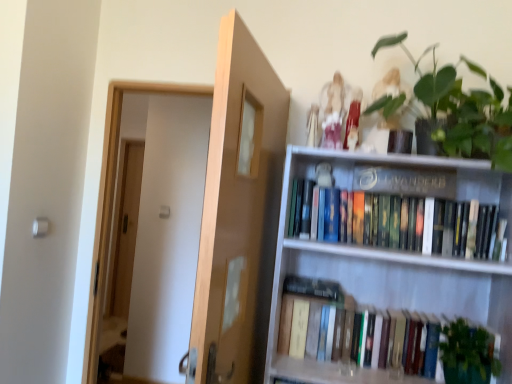
Find the location of `green matte plant at upper right`. green matte plant at upper right is located at coordinates (463, 110).

Locate an element on the screen. The image size is (512, 384). matte white statue at upper center is located at coordinates (337, 115).

From the picture: What is the approximate width of green leafy plant at lower right?

The width of green leafy plant at lower right is 7.79 inches.

Locate an element on the screen. hardcover books at lower right, which is the 1th book in bottom-to-top order is located at coordinates (349, 339).

Is light brown wood door at center to the left of white wooden bookshelf at upper right from the viewer's perspective?

Yes.

Is point (196, 294) farther from camera compared to point (281, 354)?

No, it is not.

Is light brown wood door at center next to white wooden bookshelf at upper right and touching it?

light brown wood door at center is not next to white wooden bookshelf at upper right, and they're not touching.

Could you tell me if light brown wood door at center is facing white wooden bookshelf at upper right?

Yes, light brown wood door at center is facing white wooden bookshelf at upper right.

Can you confirm if green leafy plant at lower right is taller than hardcover books at upper right, placed as the 2th book when sorted from bottom to top?

Yes, green leafy plant at lower right is taller than hardcover books at upper right, placed as the 2th book when sorted from bottom to top.

Is green leafy plant at lower right thinner than hardcover books at upper right, placed as the 2th book when sorted from bottom to top?

No, green leafy plant at lower right is not thinner than hardcover books at upper right, placed as the 2th book when sorted from bottom to top.

Considering the relative sizes of matte black bookshelf at upper center and white wooden bookshelf at upper right in the image provided, is matte black bookshelf at upper center shorter than white wooden bookshelf at upper right?

Yes.

Consider the image. From a real-world perspective, is matte black bookshelf at upper center physically below white wooden bookshelf at upper right?

Actually, matte black bookshelf at upper center is physically above white wooden bookshelf at upper right in the real world.

Can white wooden bookshelf at upper right be found inside matte black bookshelf at upper center?

No, white wooden bookshelf at upper right is not inside matte black bookshelf at upper center.

Can you tell me how much matte black bookshelf at upper center and white wooden bookshelf at upper right differ in facing direction?

There is a 0.00173-degree angle between the facing directions of matte black bookshelf at upper center and white wooden bookshelf at upper right.

Considering the positions of point (330, 134) and point (457, 135), is point (330, 134) closer or farther from the camera than point (457, 135)?

Point (330, 134).

Is matte white statue at upper center completely or partially outside of green matte plant at upper right?

Indeed, matte white statue at upper center is completely outside green matte plant at upper right.

Is green matte plant at upper right at the back of matte white statue at upper center?

No, matte white statue at upper center is not facing away from green matte plant at upper right.

From a real-world perspective, is matte white statue at upper center physically above green matte plant at upper right?

No, from a real-world perspective, matte white statue at upper center is not over green matte plant at upper right

In terms of size, does matte white statue at upper center appear bigger or smaller than green leafy plant at lower right?

In the image, matte white statue at upper center appears to be smaller than green leafy plant at lower right.

From the image's perspective, is matte white statue at upper center positioned above or below green leafy plant at lower right?

Based on their image positions, matte white statue at upper center is located above green leafy plant at lower right.

Is matte white statue at upper center oriented towards green leafy plant at lower right?

No, matte white statue at upper center is not turned towards green leafy plant at lower right.

Considering the positions of objects hardcover books at lower right, which is the second book from top to bottom, and green leafy plant at lower right in the image provided, who is more to the right, hardcover books at lower right, which is the second book from top to bottom, or green leafy plant at lower right?

green leafy plant at lower right.

In terms of width, does hardcover books at lower right, which is the 1th book in bottom-to-top order, look wider or thinner when compared to green leafy plant at lower right?

Clearly, hardcover books at lower right, which is the 1th book in bottom-to-top order, has less width compared to green leafy plant at lower right.

Is green leafy plant at lower right a part of hardcover books at lower right, which is the 1th book in bottom-to-top order?

No, green leafy plant at lower right is located outside of hardcover books at lower right, which is the 1th book in bottom-to-top order.

Considering the relative sizes of hardcover books at lower right, which is the 1th book in bottom-to-top order, and green leafy plant at lower right in the image provided, is hardcover books at lower right, which is the 1th book in bottom-to-top order, smaller than green leafy plant at lower right?

Actually, hardcover books at lower right, which is the 1th book in bottom-to-top order, might be larger than green leafy plant at lower right.

Is white wooden bookshelf at upper right turned away from hardcover books at upper right, placed as the 2th book when sorted from bottom to top?

Absolutely, white wooden bookshelf at upper right is directed away from hardcover books at upper right, placed as the 2th book when sorted from bottom to top.

Where is `book above the white wooden bookshelf at upper right (from the image's perspective)`? The height and width of the screenshot is (384, 512). book above the white wooden bookshelf at upper right (from the image's perspective) is located at coordinates (409, 224).

Based on the photo, which object is further away from the camera, white wooden bookshelf at upper right or hardcover books at upper right, placed as the 2th book when sorted from bottom to top?

hardcover books at upper right, placed as the 2th book when sorted from bottom to top, is more distant.

Who is smaller, white wooden bookshelf at upper right or hardcover books at upper right, placed as the 2th book when sorted from bottom to top?

hardcover books at upper right, placed as the 2th book when sorted from bottom to top.

Identify the location of shelf that is under the light brown wood door at center (from a real-world perspective). The height and width of the screenshot is (384, 512). (393, 255).

In the image, there is a hardcover books at upper right, which appears as the 1th book when viewed from the top. Identify the location of plant below it (from the image's perspective). (468, 354).

Considering their positions, is light brown wood door at center positioned further to white wooden bookshelf at upper right than green matte plant at upper right?

light brown wood door at center lies further to white wooden bookshelf at upper right than the other object.

Based on their spatial positions, is hardcover books at upper right, which appears as the 1th book when viewed from the top, or matte white statue at upper center further from white wooden bookshelf at upper right?

matte white statue at upper center is positioned further to the anchor white wooden bookshelf at upper right.

From the picture: Based on their spatial positions, is light brown wood door at center or hardcover books at upper right, which appears as the 1th book when viewed from the top, further from matte white statue at upper center?

light brown wood door at center.

Estimate the real-world distances between objects in this image. Which object is closer to green leafy plant at lower right, green matte plant at upper right or white wooden bookshelf at upper right?

Among the two, white wooden bookshelf at upper right is located nearer to green leafy plant at lower right.

From the image, which object appears to be farther from hardcover books at lower right, which is the second book from top to bottom, green leafy plant at lower right or green matte plant at upper right?

Among the two, green matte plant at upper right is located further to hardcover books at lower right, which is the second book from top to bottom.

Consider the image. When comparing their distances from green matte plant at upper right, does hardcover books at upper right, which appears as the 1th book when viewed from the top, or light brown wood door at center seem further?

light brown wood door at center is further to green matte plant at upper right.

Which object lies nearer to the anchor point light brown wood door at center, hardcover books at lower right, which is the second book from top to bottom, or matte white statue at upper center?

hardcover books at lower right, which is the second book from top to bottom, lies closer to light brown wood door at center than the other object.

Looking at the image, which one is located closer to green leafy plant at lower right, light brown wood door at center or matte white statue at upper center?

Among the two, light brown wood door at center is located nearer to green leafy plant at lower right.

Locate an element on the screen. book between matte black bookshelf at upper center and green leafy plant at lower right in the vertical direction is located at coordinates (409, 224).

You are a GUI agent. You are given a task and a screenshot of the screen. Output one action in this format:
    pyautogui.click(x=<x>, y=<y>)
    Task: Click on the book located between light brown wood door at center and hardcover books at upper right, placed as the 2th book when sorted from bottom to top, in the left-right direction
    This screenshot has width=512, height=384.
    Given the screenshot: What is the action you would take?
    pyautogui.click(x=349, y=339)

Image resolution: width=512 pixels, height=384 pixels. Identify the location of book between green matte plant at upper right and green leafy plant at lower right in the up-down direction. (409, 224).

Locate an element on the screen. The width and height of the screenshot is (512, 384). door between matte white statue at upper center and white wooden bookshelf at upper right in the vertical direction is located at coordinates (238, 213).